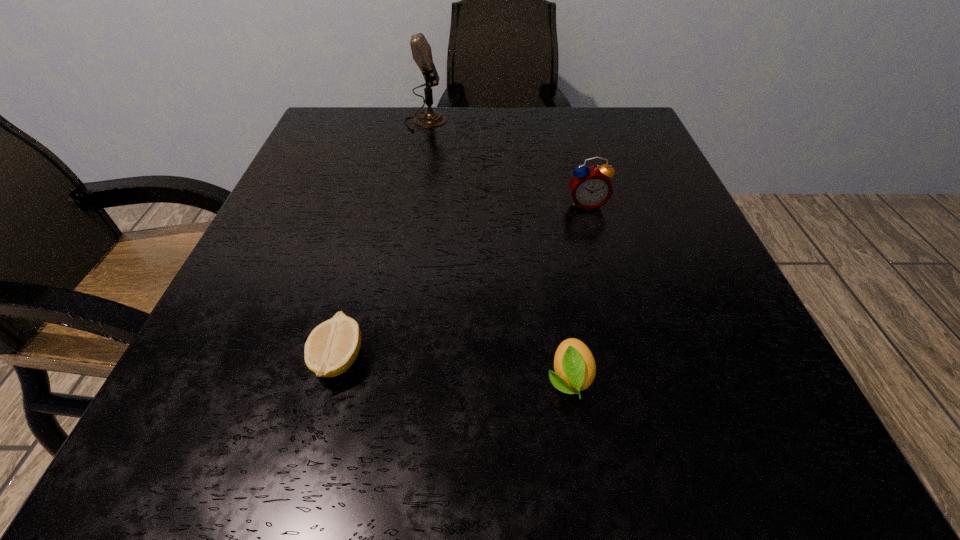
Locate an element on the screen. microphone is located at coordinates (421, 50).

Where is `the tallest object`? the tallest object is located at coordinates (421, 50).

Find the location of `the rightmost object`. the rightmost object is located at coordinates (590, 187).

This screenshot has height=540, width=960. I want to click on the third nearest object, so click(590, 187).

Locate an element on the screen. The height and width of the screenshot is (540, 960). the taller lemon is located at coordinates (574, 365).

At what (x,y) coordinates should I click in order to perform the action: click on the second object from right to left. Please return your answer as a coordinate pair (x, y). Image resolution: width=960 pixels, height=540 pixels. Looking at the image, I should click on (574, 365).

Locate an element on the screen. This screenshot has width=960, height=540. the left lemon is located at coordinates (332, 347).

At what (x,y) coordinates should I click in order to perform the action: click on the shortest object. Please return your answer as a coordinate pair (x, y). The height and width of the screenshot is (540, 960). Looking at the image, I should click on (332, 347).

Identify the location of vacant space located 0.070m on the front-facing side of the microphone. The image size is (960, 540). (477, 122).

At what (x,y) coordinates should I click in order to perform the action: click on vacant point located on the front-facing side of the second farthest object. Please return your answer as a coordinate pair (x, y). Looking at the image, I should click on (645, 414).